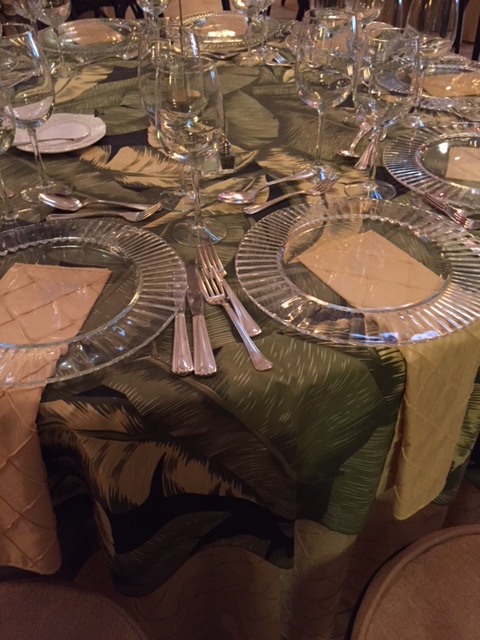
Identify the location of chair rods/bars. This screenshot has height=640, width=480. (122, 9), (138, 12), (475, 52), (457, 49), (302, 9).